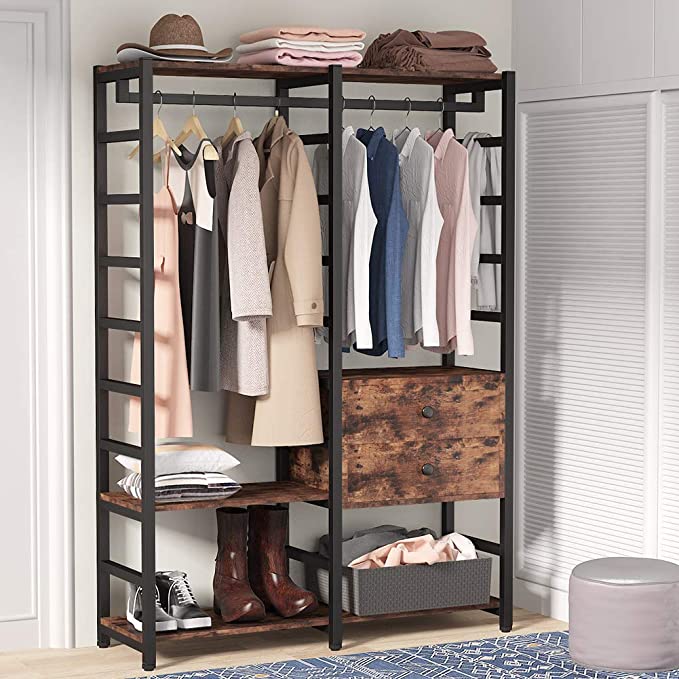
Where is `clothing on hanger`? The image size is (679, 679). clothing on hanger is located at coordinates (457, 164), (419, 170), (390, 176), (360, 187), (304, 187), (235, 208), (201, 191), (163, 227).